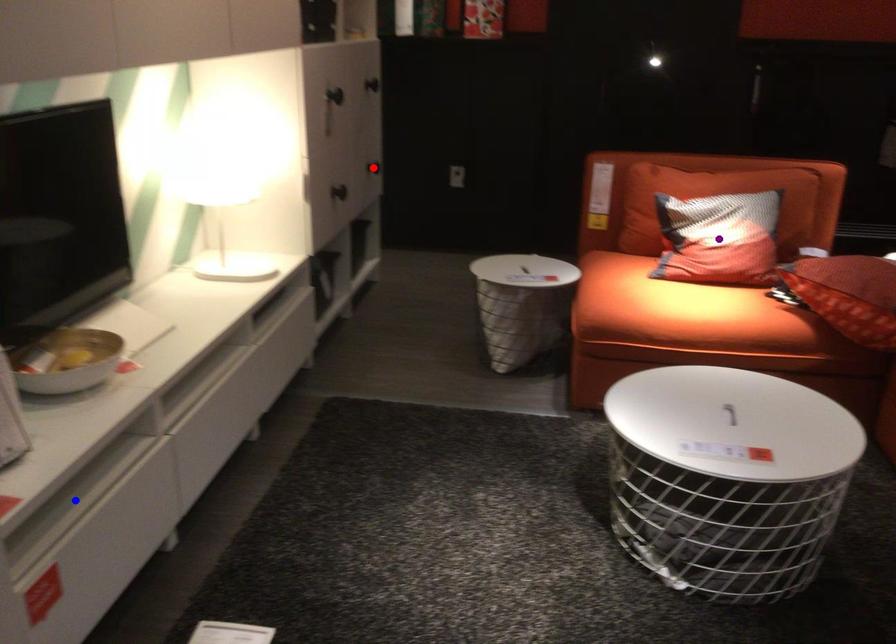
Order these from nearest to farthest:
1. red point
2. purple point
3. blue point

blue point < purple point < red point